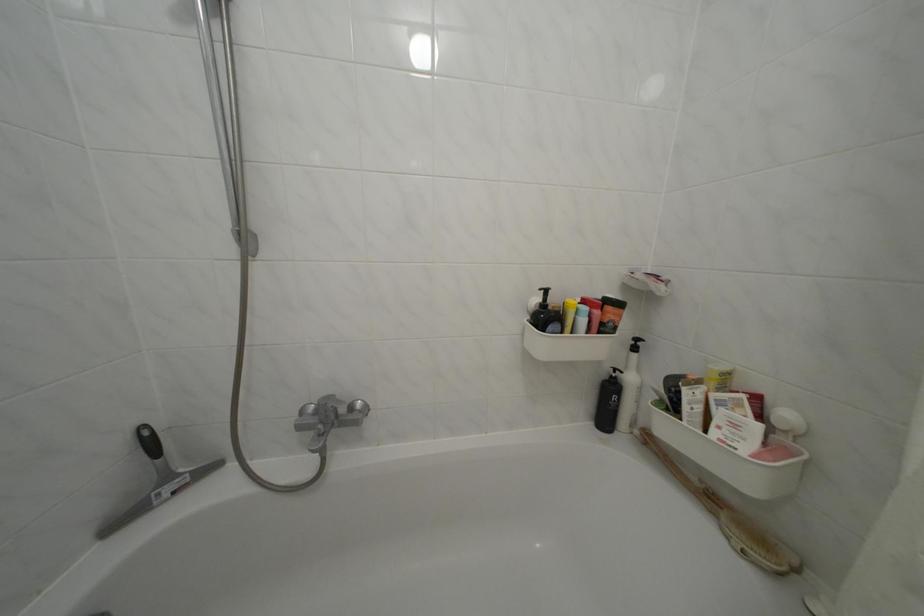
Locate an element on the screen. The height and width of the screenshot is (616, 924). dispenser pump head is located at coordinates (544, 305).